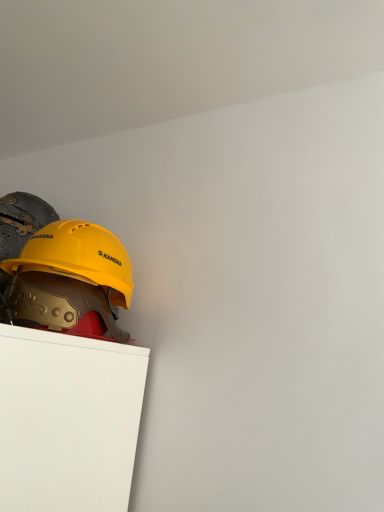
Question: Is yellow hard hat at upper left, the first helmet in the back-to-front sequence, taller or shorter than yellow matte hard hat at left, positioned as the second helmet in back-to-front order?

Choices:
 (A) short
 (B) tall

Answer: (B)

Question: In the image, is yellow hard hat at upper left, the first helmet in the back-to-front sequence, positioned in front of or behind yellow matte hard hat at left, positioned as the second helmet in back-to-front order?

Choices:
 (A) behind
 (B) front

Answer: (A)

Question: Is yellow hard hat at upper left, the first helmet in the back-to-front sequence, wider or thinner than yellow matte hard hat at left, arranged as the first helmet when viewed from the front?

Choices:
 (A) thin
 (B) wide

Answer: (B)

Question: Looking at the image, does yellow matte hard hat at left, positioned as the second helmet in back-to-front order, seem bigger or smaller compared to yellow hard hat at upper left, the first helmet in the back-to-front sequence?

Choices:
 (A) big
 (B) small

Answer: (B)

Question: From the image's perspective, is yellow matte hard hat at left, arranged as the first helmet when viewed from the front, above or below yellow hard hat at upper left, the first helmet in the back-to-front sequence?

Choices:
 (A) above
 (B) below

Answer: (A)

Question: Does point (1, 291) appear closer or farther from the camera than point (114, 284)?

Choices:
 (A) closer
 (B) farther

Answer: (A)

Question: From a real-world perspective, is yellow matte hard hat at left, arranged as the first helmet when viewed from the front, physically located above or below yellow hard hat at upper left, acting as the 2th helmet starting from the front?

Choices:
 (A) below
 (B) above

Answer: (A)